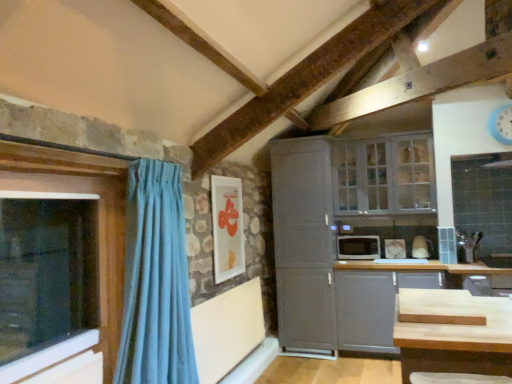
Locate an element on the screen. vacant area on top of white glossy picture frame at upper center (from a real-world perspective) is located at coordinates (224, 176).